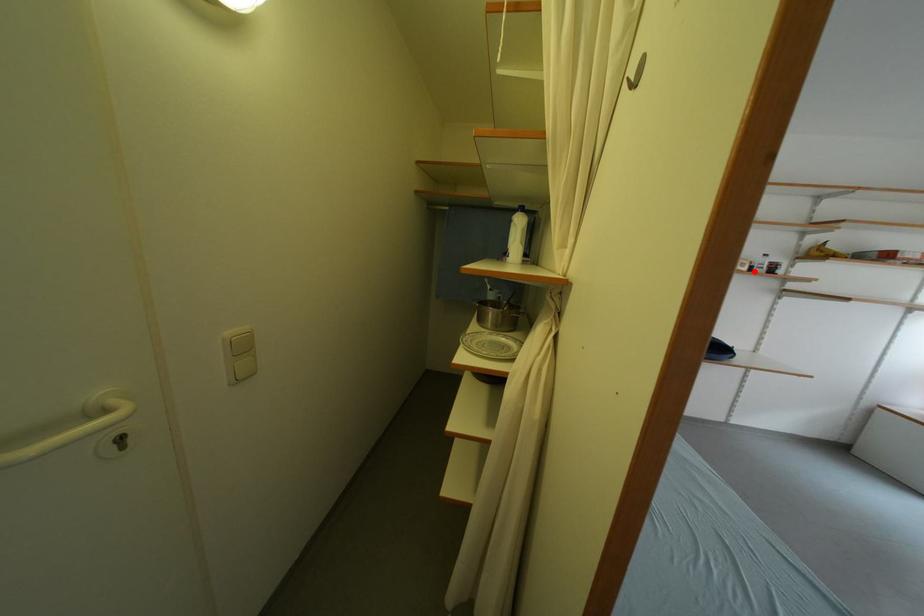
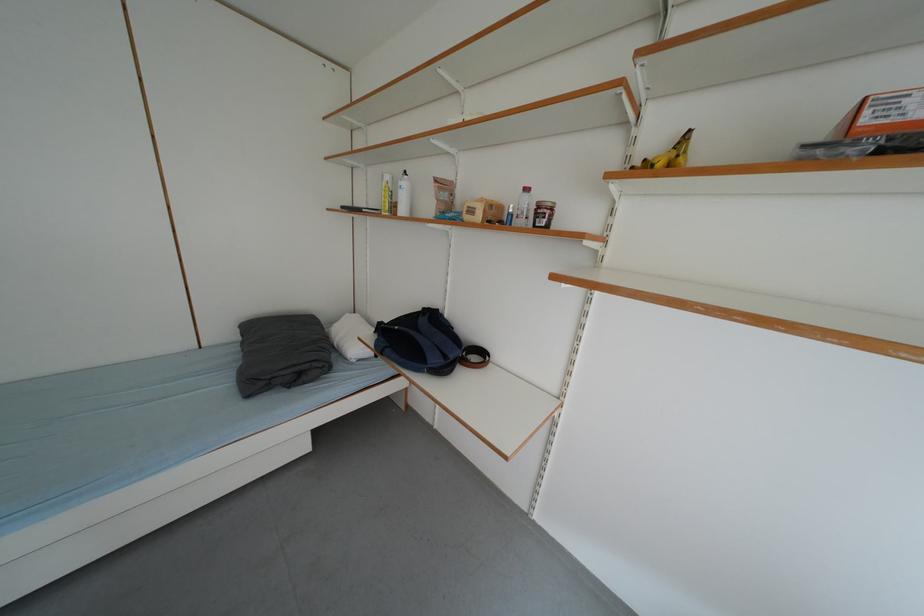
Where in the second image is the point corresponding to the highlighted location from the first image?

(487, 220)